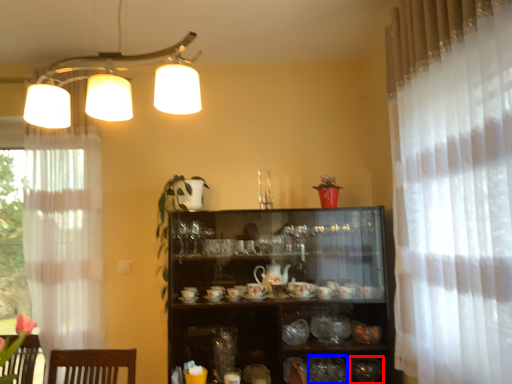
Question: Which object appears closest to the camera in this image, tableware (highlighted by a red box) or tableware (highlighted by a blue box)?

Choices:
 (A) tableware
 (B) tableware

Answer: (B)